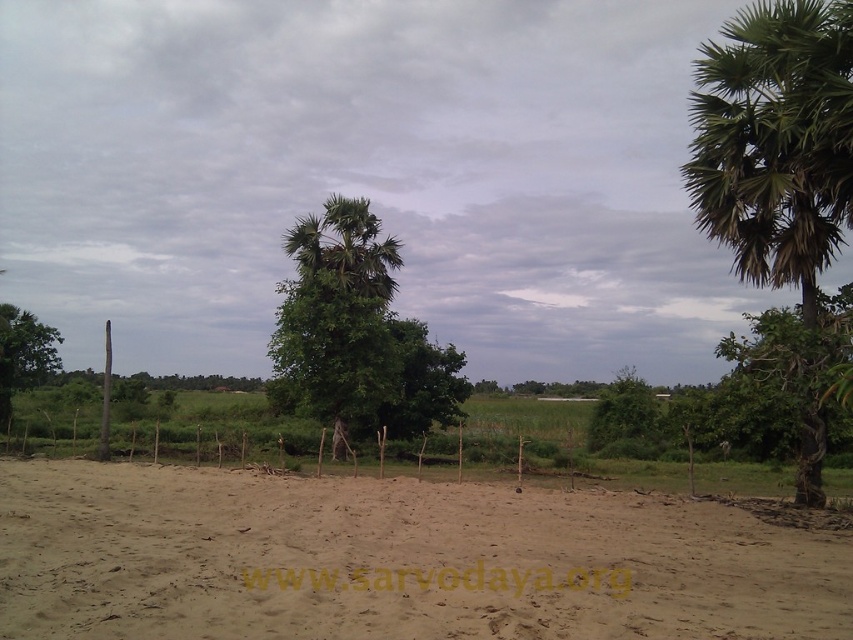
Is green leafy tree at center to the right of green leafy tree at left from the viewer's perspective?

Correct, you'll find green leafy tree at center to the right of green leafy tree at left.

Find the location of a particular element. green leafy tree at center is located at coordinates (355, 333).

Which is above, green leafy palm tree at right or green leafy tree at center?

green leafy palm tree at right

Is green leafy palm tree at right in front of green leafy tree at center?

Yes, green leafy palm tree at right is in front of green leafy tree at center.

Locate an element on the screen. The image size is (853, 640). green leafy palm tree at right is located at coordinates (775, 144).

Is brown sandy dirt field at center above green leafy tree at center?

Actually, brown sandy dirt field at center is below green leafy tree at center.

Is point (265, 483) farther from viewer compared to point (300, 358)?

No.

The height and width of the screenshot is (640, 853). I want to click on brown sandy dirt field at center, so click(x=393, y=561).